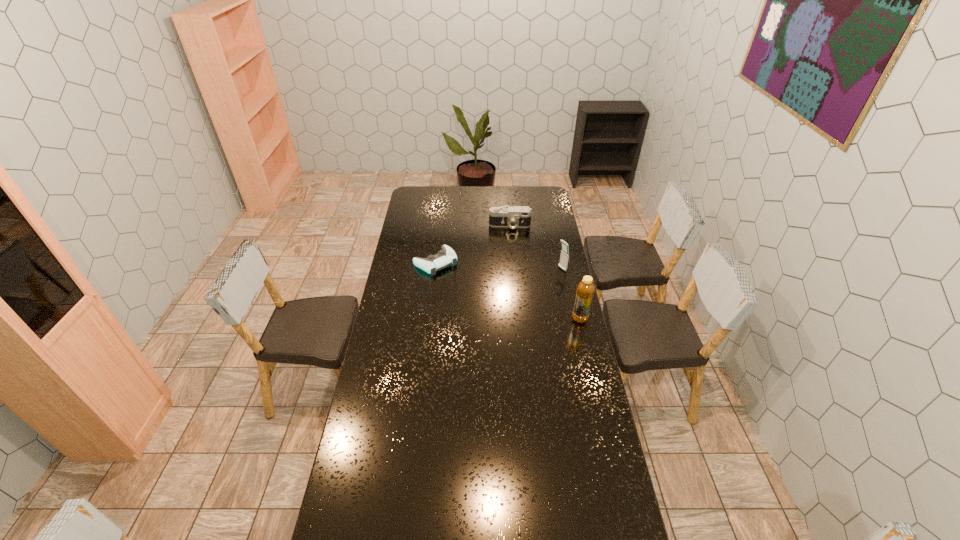
Locate an element on the screen. free area in between the control and the tallest object is located at coordinates (508, 290).

Where is `free point between the camera and the nearest object`? free point between the camera and the nearest object is located at coordinates (545, 272).

At what (x,y) coordinates should I click in order to perform the action: click on free space between the bottle and the farthest object. Please return your answer as a coordinate pair (x, y). This screenshot has height=540, width=960. Looking at the image, I should click on (545, 272).

At what (x,y) coordinates should I click in order to perform the action: click on object that is the third closest to the third tallest object. Please return your answer as a coordinate pair (x, y). Looking at the image, I should click on (585, 290).

You are a GUI agent. You are given a task and a screenshot of the screen. Output one action in this format:
    pyautogui.click(x=<x>, y=<y>)
    Task: Click on the object that is the second closest to the third object from right to left
    The height and width of the screenshot is (540, 960).
    Given the screenshot: What is the action you would take?
    pyautogui.click(x=564, y=257)

You are a GUI agent. You are given a task and a screenshot of the screen. Output one action in this format:
    pyautogui.click(x=<x>, y=<y>)
    Task: Click on the free space that satisfies the following two spatial constraints: 1. on the front side of the tallest object; 2. on the left side of the farthest object
    The height and width of the screenshot is (540, 960).
    Given the screenshot: What is the action you would take?
    pyautogui.click(x=518, y=319)

Where is `free space that satisfies the following two spatial constraints: 1. on the front side of the third tallest object; 2. on the right side of the second tallest object`? This screenshot has width=960, height=540. free space that satisfies the following two spatial constraints: 1. on the front side of the third tallest object; 2. on the right side of the second tallest object is located at coordinates (514, 269).

Find the location of a particular element. free location that satisfies the following two spatial constraints: 1. on the front side of the second tallest object; 2. on the left side of the camera is located at coordinates (514, 269).

What are the coordinates of `vacant space that satisfies the following two spatial constraints: 1. on the front side of the cellular telephone; 2. on the right side of the leftmost object` in the screenshot? It's located at (435, 269).